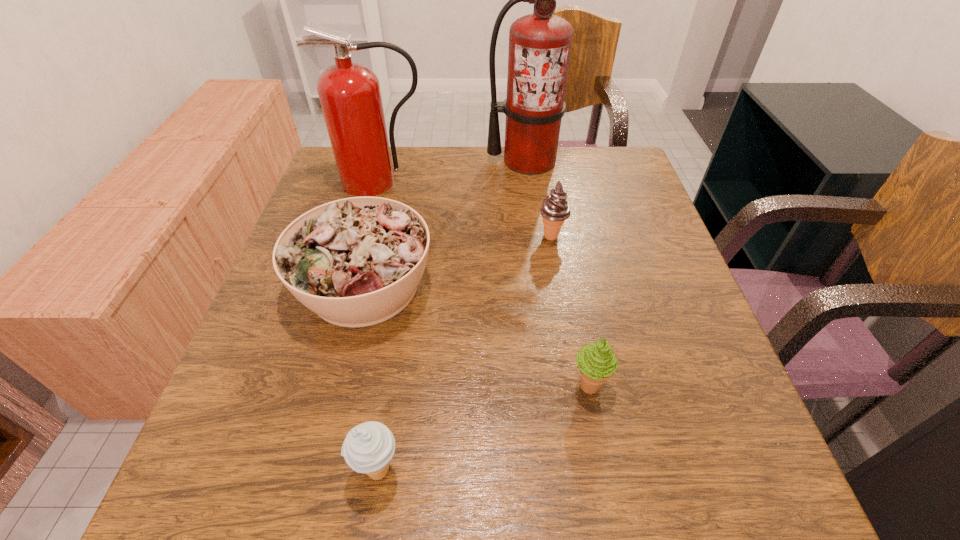
Find the location of a particular element. This screenshot has height=540, width=960. free region that satisfies the following two spatial constraints: 1. toward the nozzle of the second nearest icecream; 2. on the right side of the right fire extinguisher is located at coordinates (559, 386).